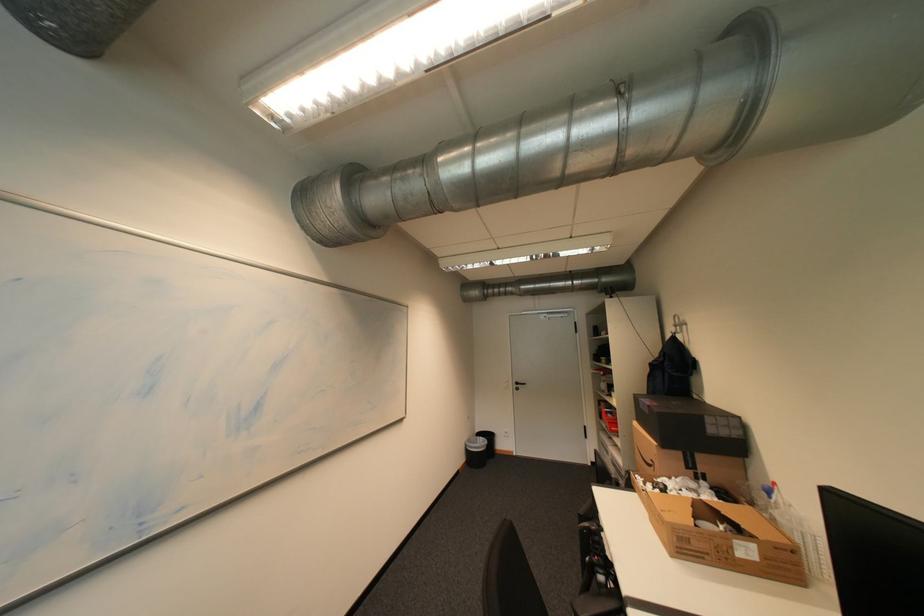
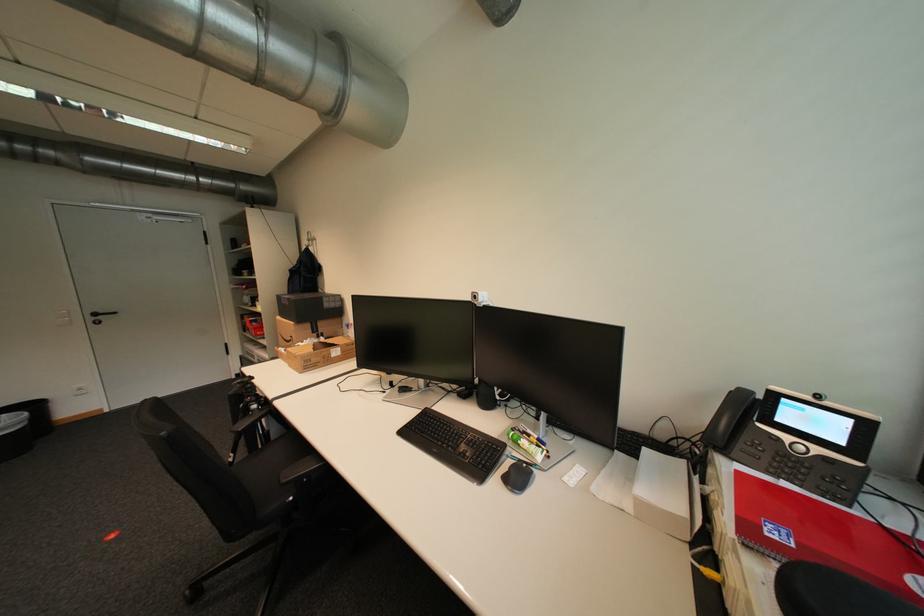
Where in the second image is the point corresponding to (489,438) from the first image?

(11, 416)